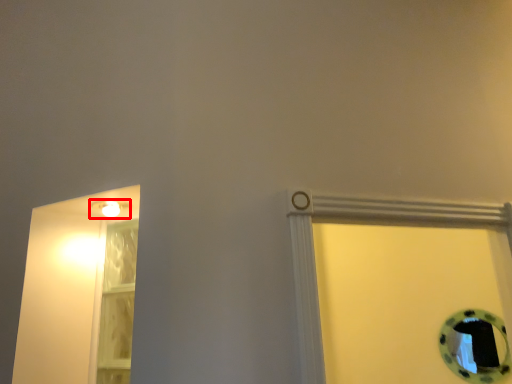
Question: Considering the relative positions of light fixture (annotated by the red box) and glass door in the image provided, where is light fixture (annotated by the red box) located with respect to the staircase?

Choices:
 (A) right
 (B) left

Answer: (B)